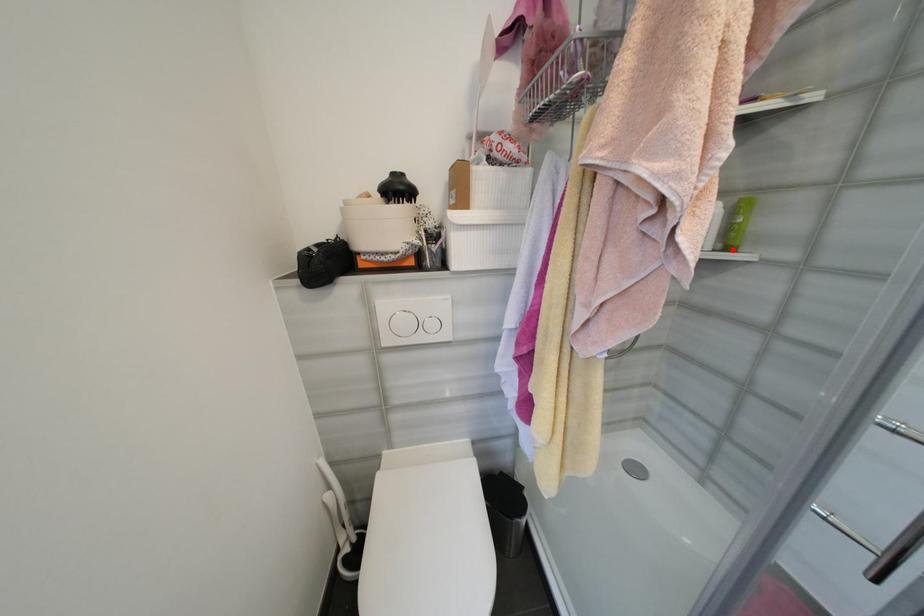
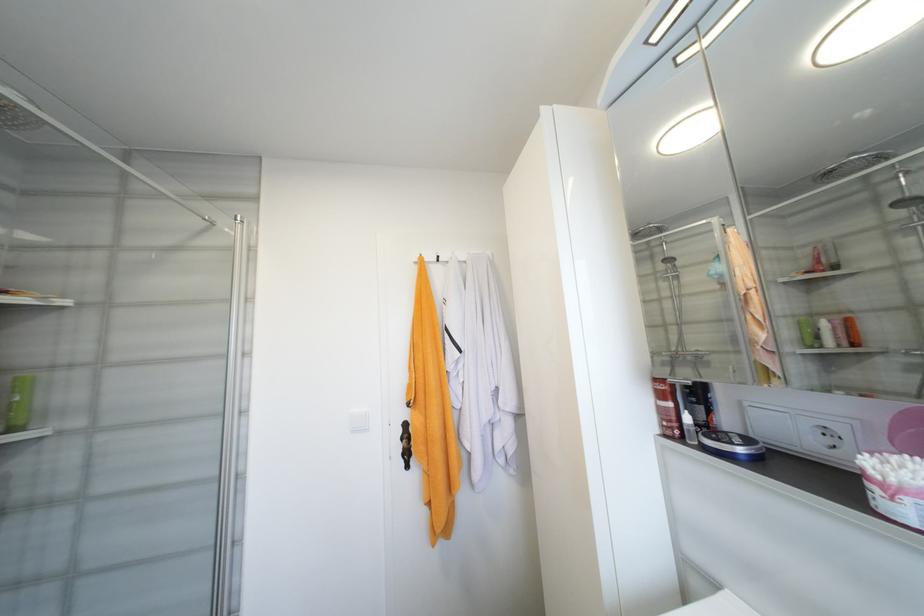
Question: I am providing you with two images of the same scene from different viewpoints. Given a red point in image1, look at the same physical point in image2. Is it:

Choices:
 (A) Closer to the viewpoint
 (B) Farther from the viewpoint

Answer: (A)